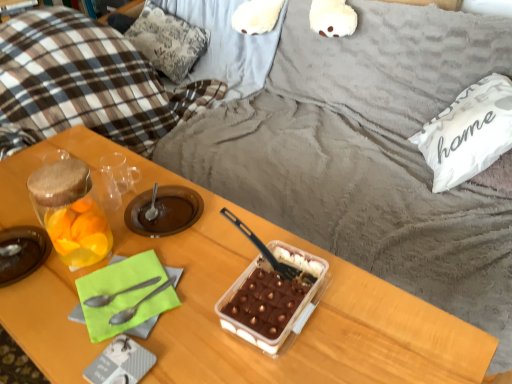
The image size is (512, 384). Identify the location of vacant space in front of black plastic spoon at center, the first spoon positioned from the right. (261, 349).